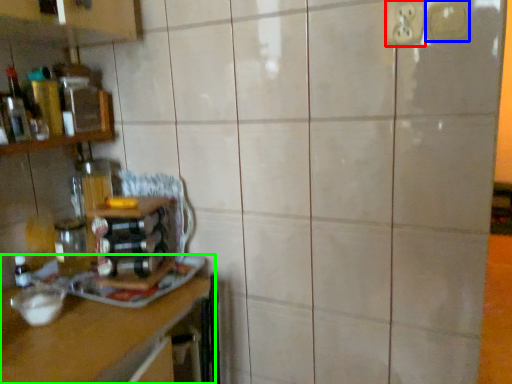
Question: Which object is positioned farthest from electric outlet (highlighted by a red box)? Select from electric outlet (highlighted by a blue box) and countertop (highlighted by a green box).

Choices:
 (A) electric outlet
 (B) countertop

Answer: (B)